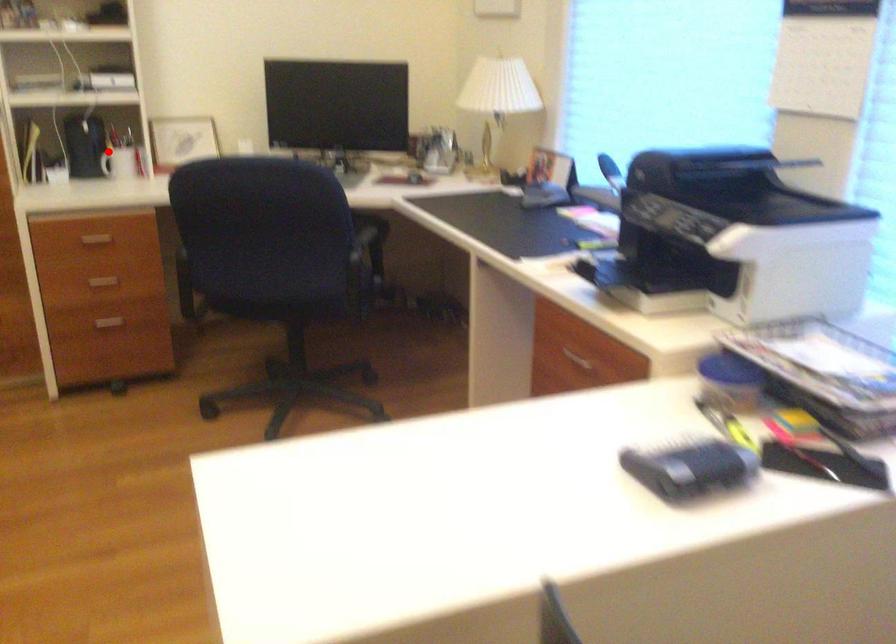
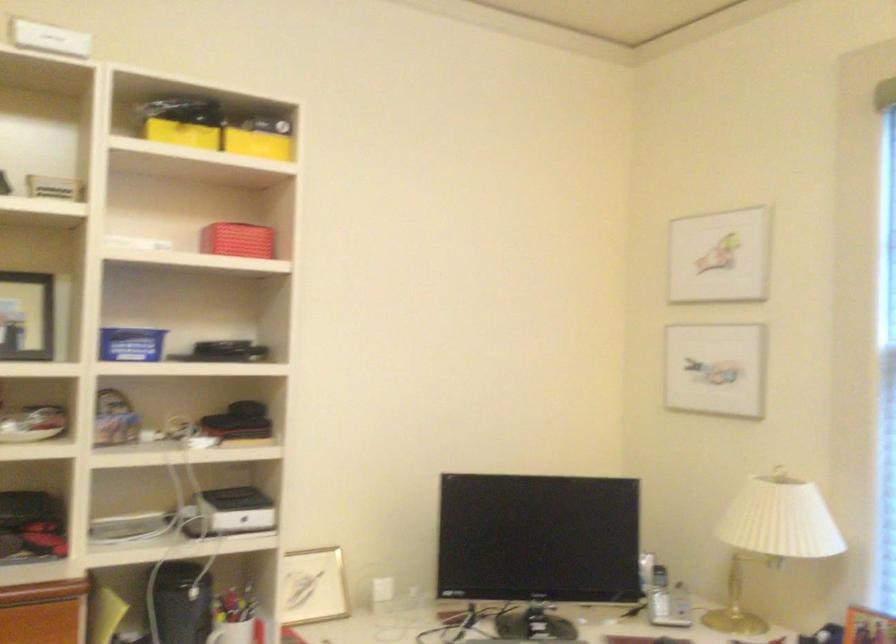
Question: I am providing you with two images of the same scene from different viewpoints. Image1 has a red point marked. In image2, the corresponding 3D location appears at what relative position? Reply with the corresponding letter.

Choices:
 (A) Closer
 (B) Farther

Answer: (A)